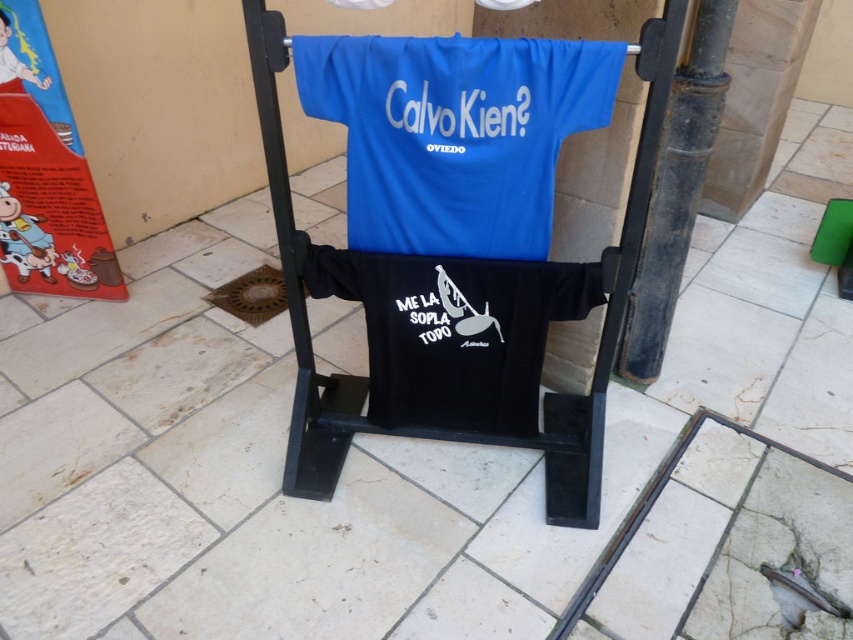
You are standing at the entrance of the outdoor area and want to sit on the metallic black folding chair at center. Is the chair positioned directly in front of you or to your left or right side?

Result: The metallic black folding chair at center is located at point coordinates which would be directly in front of you if you are facing the stand with the Tshirts and the poster to your left.

You are setting up a small outdoor event and need to place a 20 inch wide table between the metallic black folding chair at center and the black matte pole at center. Can the table fit in the space between them?

The metallic black folding chair at center is 19.80 inches away from the black matte pole at center, so the table cannot fit since it requires at least 20 inches of space.